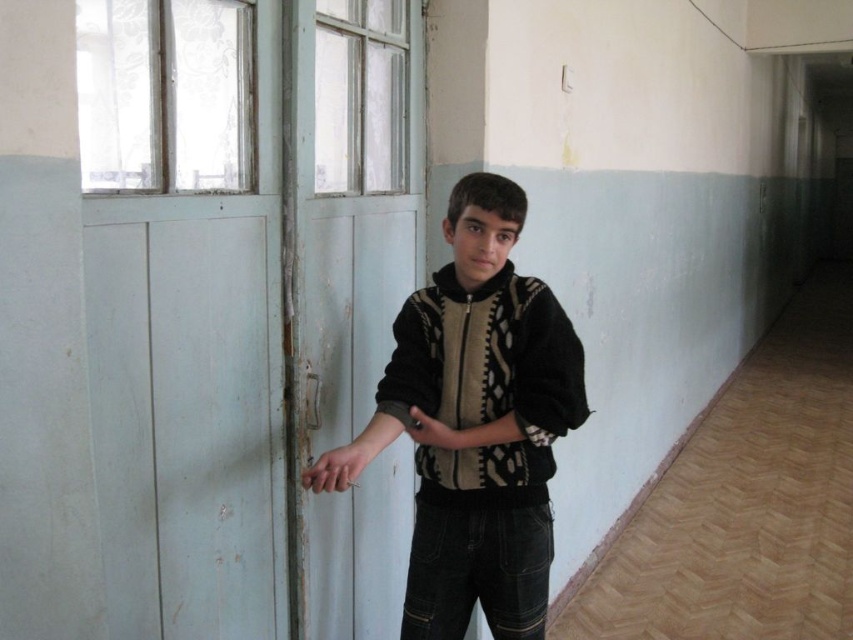
Does knitted sweater at center appear on the right side of black matte arm at center?

Yes, knitted sweater at center is to the right of black matte arm at center.

Can you confirm if knitted sweater at center is taller than black matte arm at center?

Indeed, knitted sweater at center has a greater height compared to black matte arm at center.

What are the coordinates of `knitted sweater at center` in the screenshot? It's located at (474, 422).

Who is taller, knitted sweater at center or black textured sweater at center?

knitted sweater at center is taller.

Can you confirm if knitted sweater at center is positioned below black textured sweater at center?

Yes.

Measure the distance between knitted sweater at center and camera.

A distance of 1.37 meters exists between knitted sweater at center and camera.

Where is `knitted sweater at center`? knitted sweater at center is located at coordinates coord(474,422).

Based on the photo, is black textured sweater at center below black matte arm at center?

No, black textured sweater at center is not below black matte arm at center.

Can you confirm if black textured sweater at center is smaller than black matte arm at center?

Yes.

Identify the location of black textured sweater at center. (490, 362).